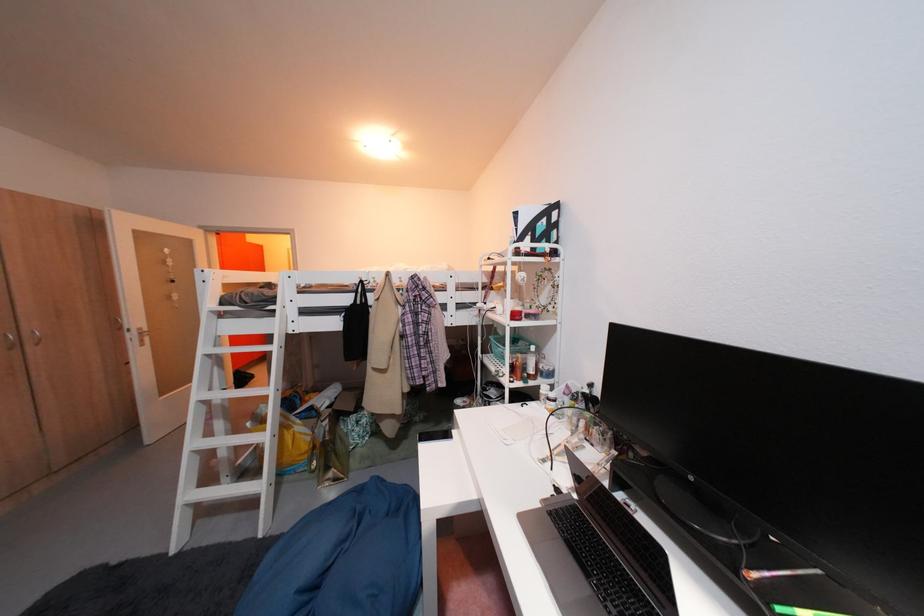
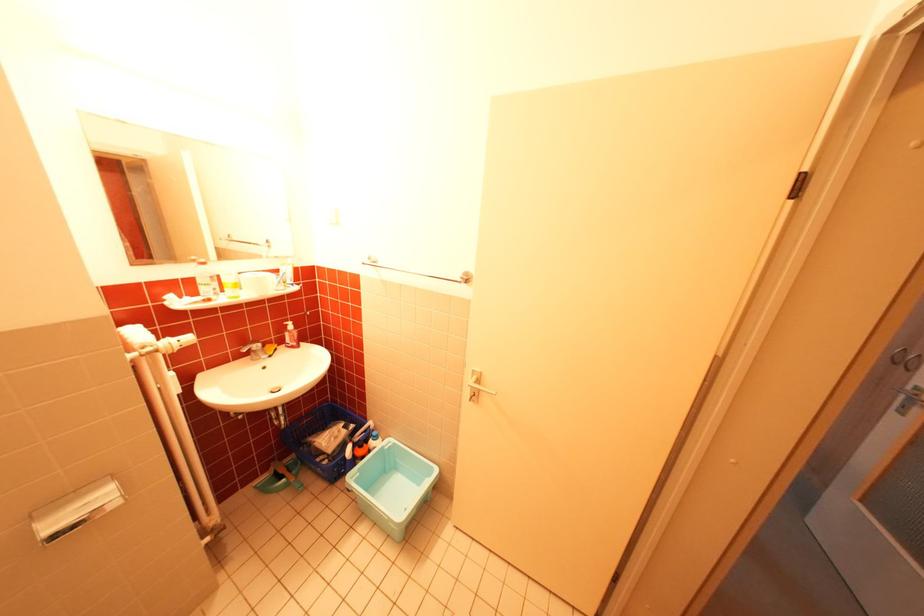
Question: I am providing you with two images of the same scene from different viewpoints. After the viewpoint changes to image2, which objects are now occluded?

Choices:
 (A) black tote bag
 (B) blue plastic basket
 (C) green plastic dustpan
 (D) purple folded towel

Answer: (A)